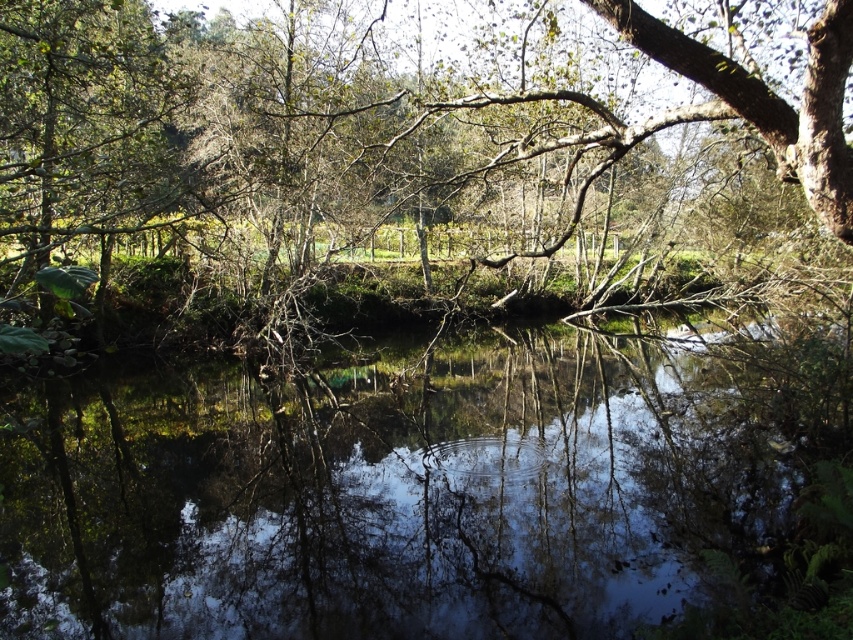
You are standing at the edge of the pond and see a point marked at coordinates (387, 493). Based on the scene description, is this point located on the water or on the surrounding land?

The point at (387, 493) is on transparent water at center, so it is located on the water.

You are standing on the edge of the pond and see the transparent water at center and the green leafy tree at upper center. Which object is closer to the ground?

The transparent water at center is closer to the ground because it is located below the green leafy tree at upper center.